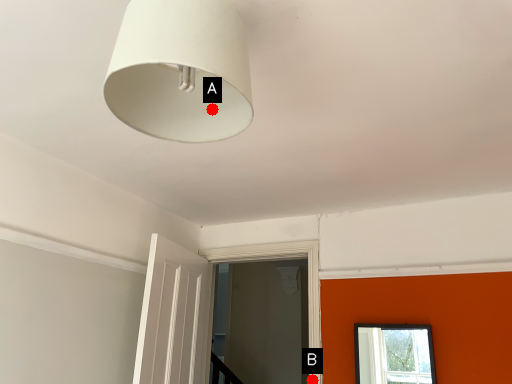
Question: Two points are circled on the image, labeled by A and B beside each circle. Which point is closer to the camera?

Choices:
 (A) A is closer
 (B) B is closer

Answer: (A)